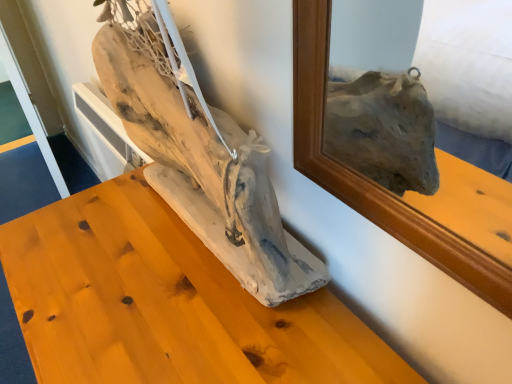
Question: Would you say driftwood sculpture at center is outside natural wood driftwood at center?

Choices:
 (A) yes
 (B) no

Answer: (A)

Question: From a real-world perspective, is driftwood sculpture at center physically above natural wood driftwood at center?

Choices:
 (A) no
 (B) yes

Answer: (A)

Question: Can you confirm if driftwood sculpture at center is smaller than natural wood driftwood at center?

Choices:
 (A) no
 (B) yes

Answer: (A)

Question: Can you confirm if driftwood sculpture at center is shorter than natural wood driftwood at center?

Choices:
 (A) yes
 (B) no

Answer: (B)

Question: Considering the relative sizes of driftwood sculpture at center and natural wood driftwood at center in the image provided, is driftwood sculpture at center bigger than natural wood driftwood at center?

Choices:
 (A) no
 (B) yes

Answer: (B)

Question: From a real-world perspective, is driftwood sculpture at center under natural wood driftwood at center?

Choices:
 (A) yes
 (B) no

Answer: (A)

Question: From a real-world perspective, is natural wood driftwood at center under driftwood sculpture at center?

Choices:
 (A) yes
 (B) no

Answer: (B)

Question: Is natural wood driftwood at center oriented away from driftwood sculpture at center?

Choices:
 (A) no
 (B) yes

Answer: (A)

Question: Is natural wood driftwood at center aimed at driftwood sculpture at center?

Choices:
 (A) yes
 (B) no

Answer: (B)

Question: Would you say natural wood driftwood at center is outside driftwood sculpture at center?

Choices:
 (A) yes
 (B) no

Answer: (A)

Question: Considering the relative sizes of natural wood driftwood at center and driftwood sculpture at center in the image provided, is natural wood driftwood at center taller than driftwood sculpture at center?

Choices:
 (A) no
 (B) yes

Answer: (A)

Question: Considering the relative positions of natural wood driftwood at center and driftwood sculpture at center in the image provided, is natural wood driftwood at center to the left of driftwood sculpture at center from the viewer's perspective?

Choices:
 (A) no
 (B) yes

Answer: (A)

Question: In the image, is natural wood driftwood at center positioned in front of or behind driftwood sculpture at center?

Choices:
 (A) front
 (B) behind

Answer: (A)